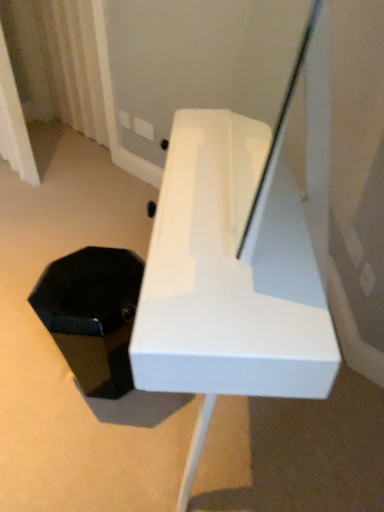
Question: Could you tell me if black matte hexagonal box at lower left is facing white glossy bench at center?

Choices:
 (A) no
 (B) yes

Answer: (B)

Question: Is black matte hexagonal box at lower left outside white glossy bench at center?

Choices:
 (A) no
 (B) yes

Answer: (B)

Question: From a real-world perspective, is black matte hexagonal box at lower left physically above white glossy bench at center?

Choices:
 (A) no
 (B) yes

Answer: (A)

Question: Is black matte hexagonal box at lower left behind white glossy bench at center?

Choices:
 (A) yes
 (B) no

Answer: (A)

Question: Does black matte hexagonal box at lower left appear on the left side of white glossy bench at center?

Choices:
 (A) no
 (B) yes

Answer: (B)

Question: Is white sheer curtain at upper left inside or outside of white glossy bench at center?

Choices:
 (A) outside
 (B) inside

Answer: (A)

Question: Would you say white sheer curtain at upper left is to the left or to the right of white glossy bench at center in the picture?

Choices:
 (A) left
 (B) right

Answer: (A)

Question: From a real-world perspective, is white sheer curtain at upper left physically located above or below white glossy bench at center?

Choices:
 (A) above
 (B) below

Answer: (A)

Question: Is point (92, 35) closer or farther from the camera than point (210, 114)?

Choices:
 (A) closer
 (B) farther

Answer: (B)

Question: Is white glossy bench at center wider or thinner than white sheer curtain at upper left?

Choices:
 (A) thin
 (B) wide

Answer: (B)

Question: In the image, is white glossy bench at center positioned in front of or behind white sheer curtain at upper left?

Choices:
 (A) behind
 (B) front

Answer: (B)

Question: Is point (205, 340) closer or farther from the camera than point (94, 84)?

Choices:
 (A) farther
 (B) closer

Answer: (B)

Question: Is white glossy bench at center inside or outside of white sheer curtain at upper left?

Choices:
 (A) outside
 (B) inside

Answer: (A)

Question: From the image's perspective, is white sheer curtain at upper left located above or below black matte hexagonal box at lower left?

Choices:
 (A) above
 (B) below

Answer: (A)

Question: From their relative heights in the image, would you say white sheer curtain at upper left is taller or shorter than black matte hexagonal box at lower left?

Choices:
 (A) tall
 (B) short

Answer: (A)